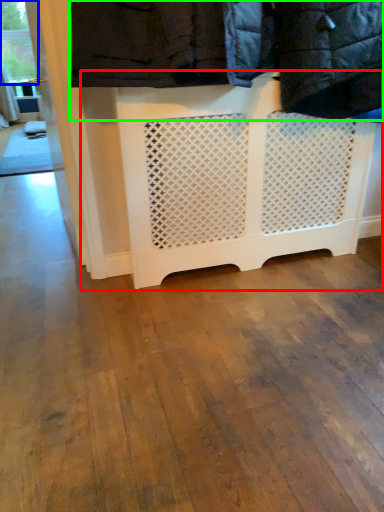
Question: Considering the real-world distances, which object is farthest from furniture (highlighted by a red box)? window frame (highlighted by a blue box) or laundry (highlighted by a green box)?

Choices:
 (A) window frame
 (B) laundry

Answer: (A)